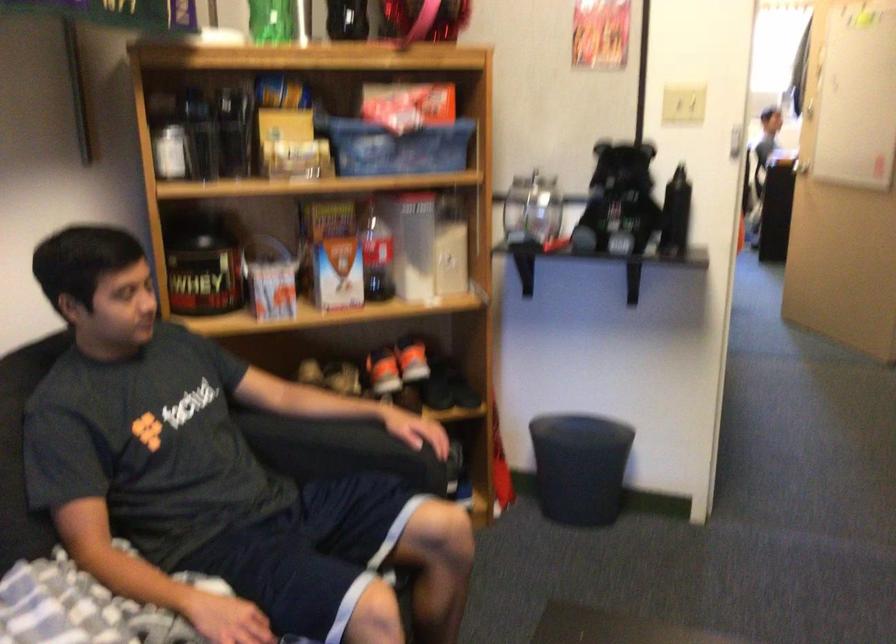
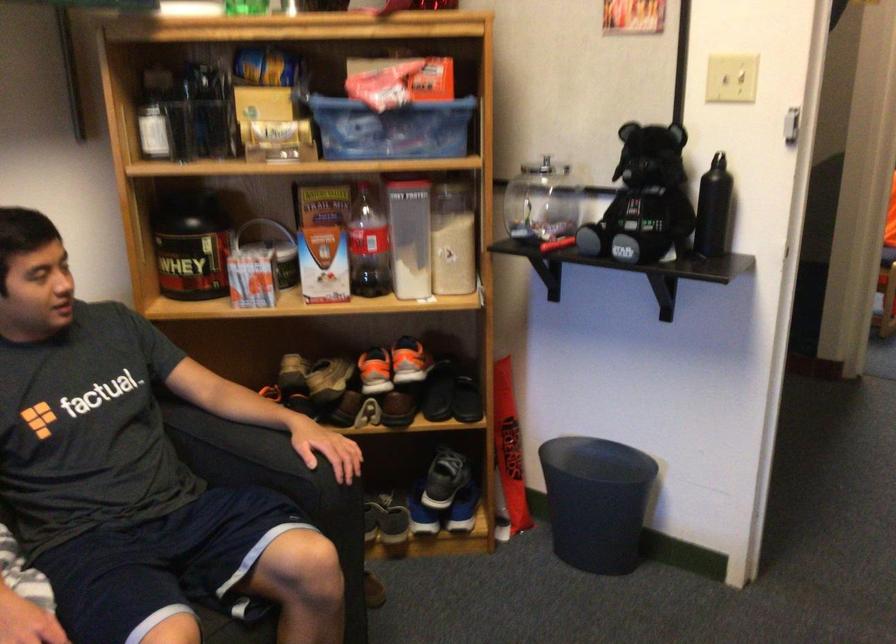
In the second image, find the point that corresponds to pixel 688 98 in the first image.

(730, 78)